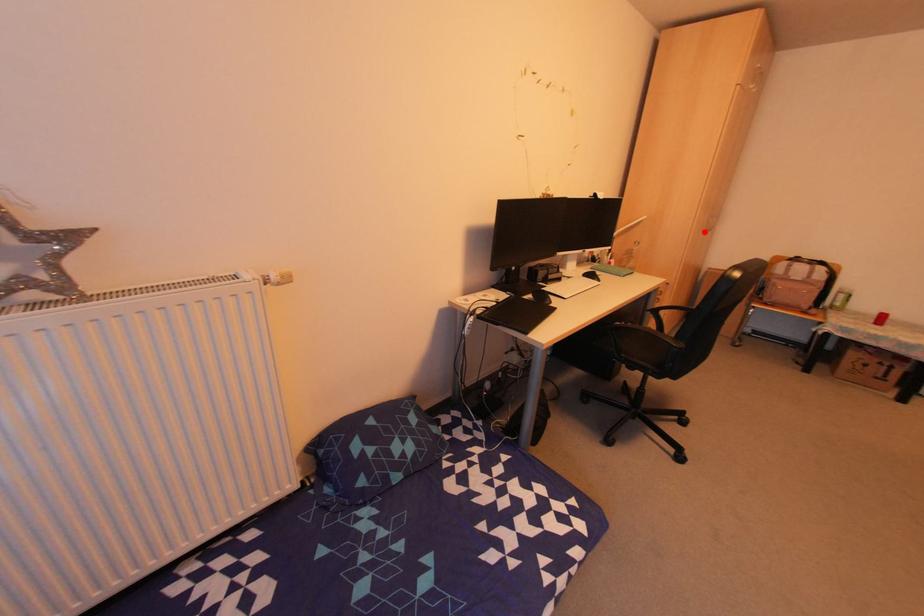
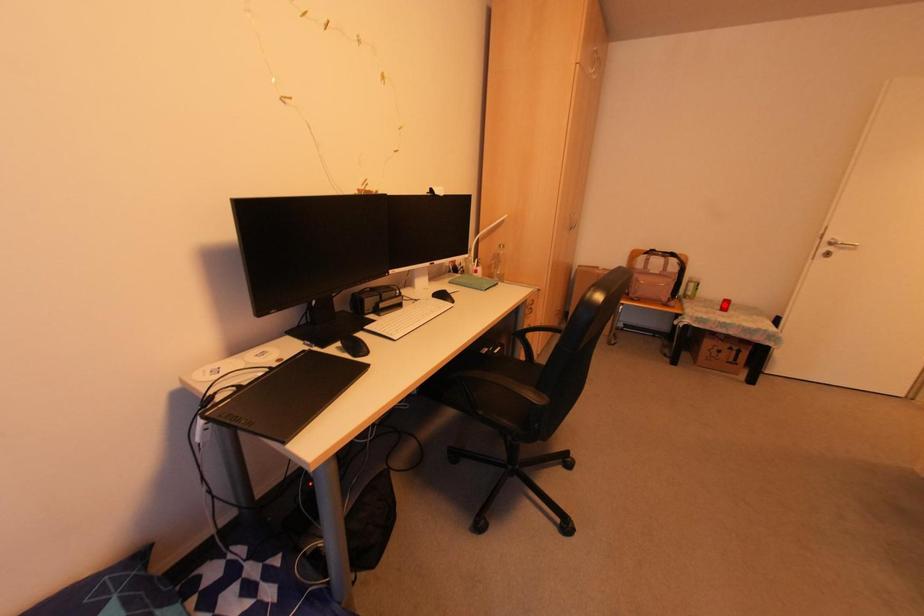
I am providing you with two images of the same scene from different viewpoints. A red point is marked on the first image and another point is marked on the second image. Do the highlighted points in image1 and image2 indicate the same real-world spot?

No